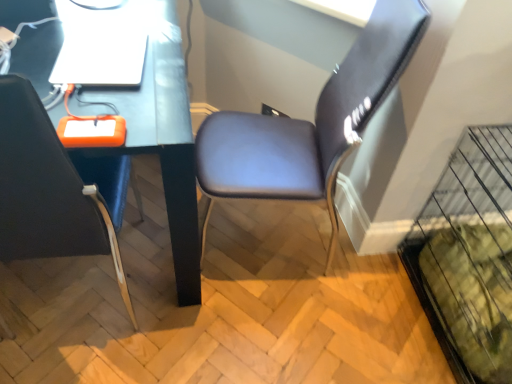
Find the location of `free location to the right of suede-like brown chair at center-right, which appears as the 2th chair when viewed from the left`. free location to the right of suede-like brown chair at center-right, which appears as the 2th chair when viewed from the left is located at coordinates (366, 281).